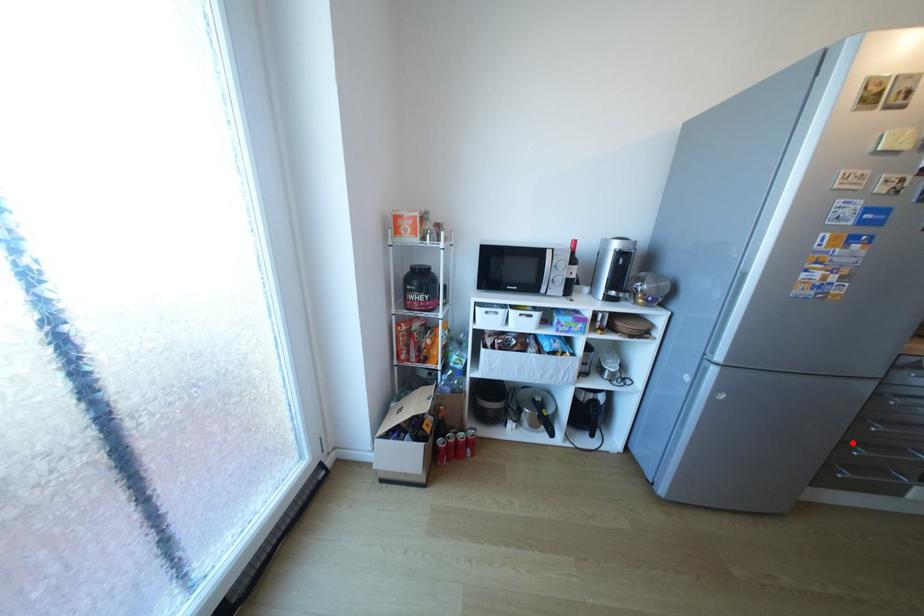
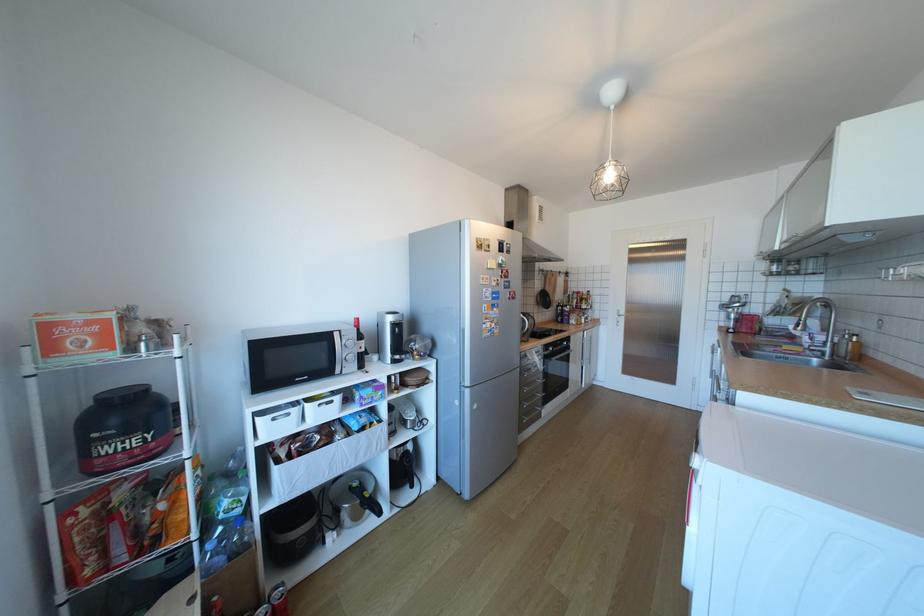
Where in the second image is the point corresponding to the highlighted location from the first image?

(529, 403)